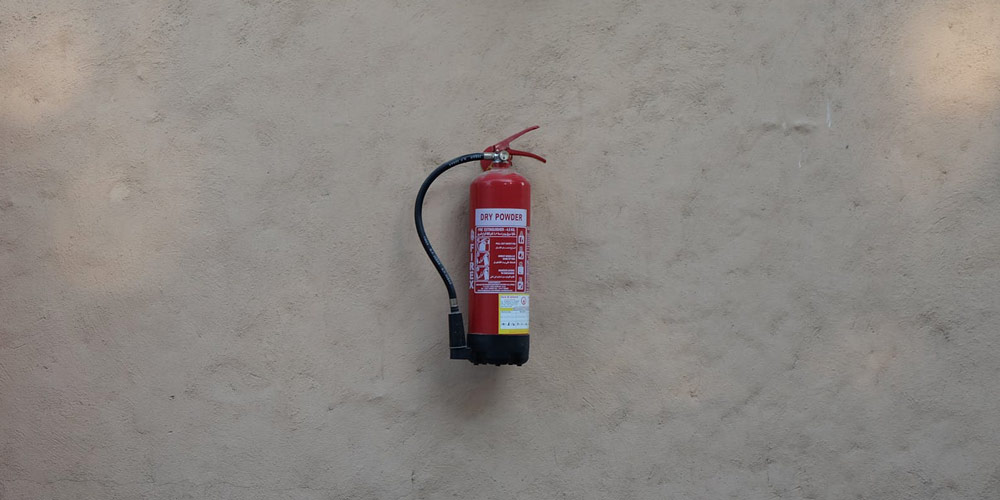
Where is `canister`? Image resolution: width=1000 pixels, height=500 pixels. canister is located at coordinates (507, 197).